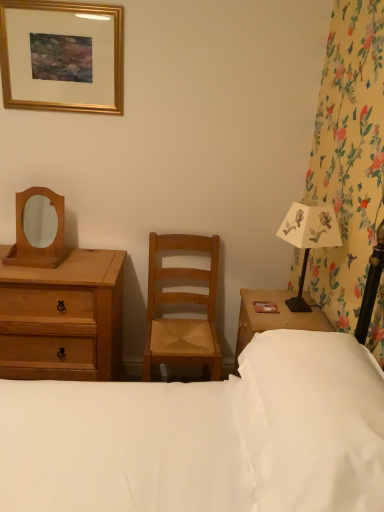
You are a GUI agent. You are given a task and a screenshot of the screen. Output one action in this format:
    pyautogui.click(x=<x>, y=<y>)
    Task: Click on the vacant area in front of wooden mirror at left
    
    Given the screenshot: What is the action you would take?
    pyautogui.click(x=27, y=273)